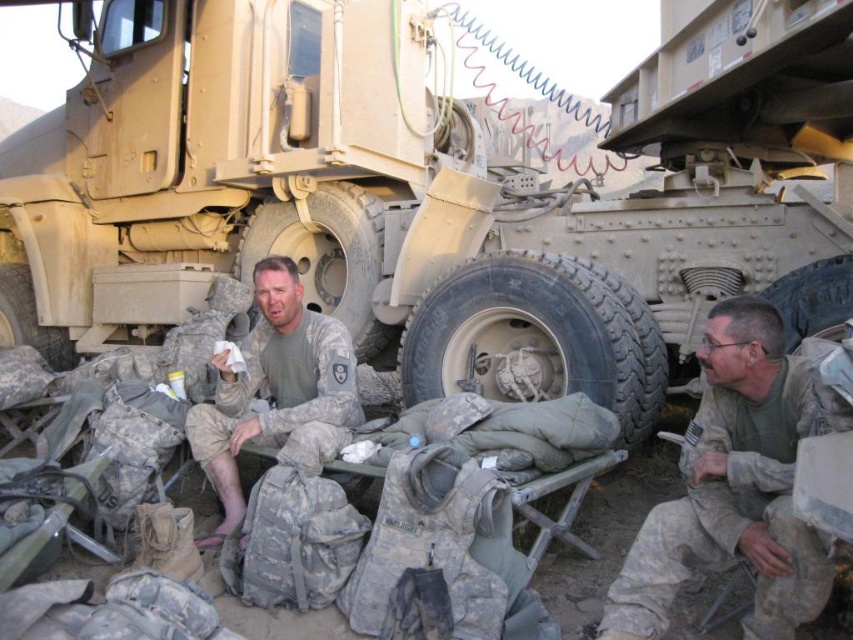
You are a photographer positioned at the center of the scene. You want to take a photo focusing on the camouflage fabric uniform at center and camouflage fabric tire at center. Which object will appear larger in the photo?

The camouflage fabric uniform at center will appear larger in the photo because it is closer to the viewer than the camouflage fabric tire at center.